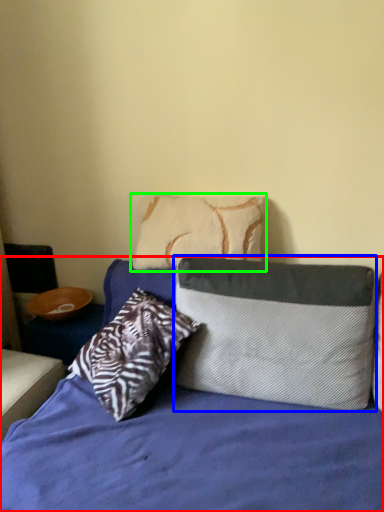
Question: Based on their relative distances, which object is farther from bed (highlighted by a red box)? Choose from pillow (highlighted by a blue box) and pillow (highlighted by a green box).

Choices:
 (A) pillow
 (B) pillow

Answer: (B)